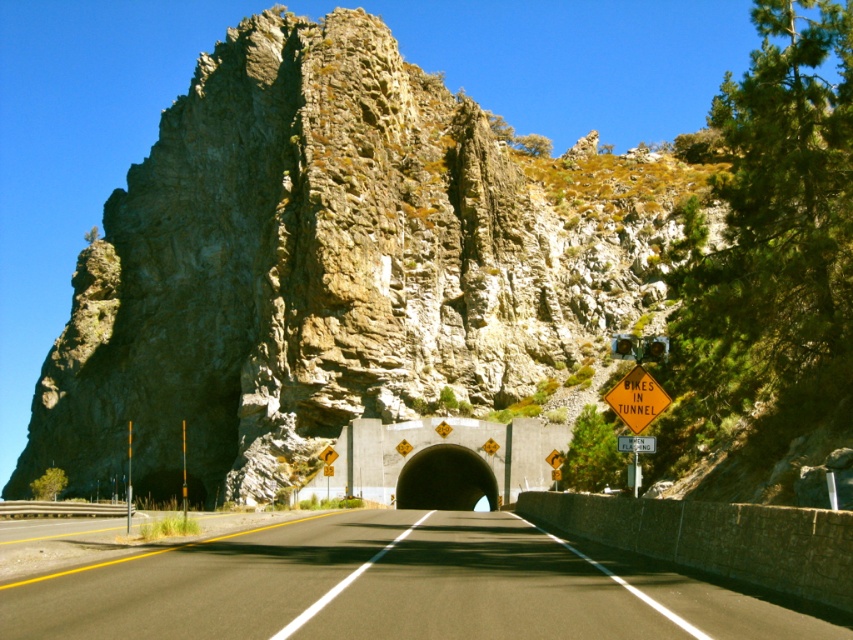
Question: Which of the following is the closest to the observer?

Choices:
 (A) yellow reflective diamond at center
 (B) orange reflective plastic sign at center
 (C) rocky cliff at center

Answer: (A)

Question: Does black asphalt road at center have a smaller size compared to orange reflective plastic sign at center?

Choices:
 (A) yes
 (B) no

Answer: (B)

Question: Is rocky cliff at center wider than black rubber tunnel at center?

Choices:
 (A) yes
 (B) no

Answer: (A)

Question: Which point appears farthest from the camera in this image?

Choices:
 (A) (630, 394)
 (B) (463, 476)
 (C) (651, 442)
 (D) (177, 81)

Answer: (D)

Question: Is rocky cliff at center in front of orange reflective plastic sign at center?

Choices:
 (A) no
 (B) yes

Answer: (A)

Question: Which of the following is the closest to the observer?

Choices:
 (A) rocky cliff at center
 (B) orange reflective plastic sign at center

Answer: (B)